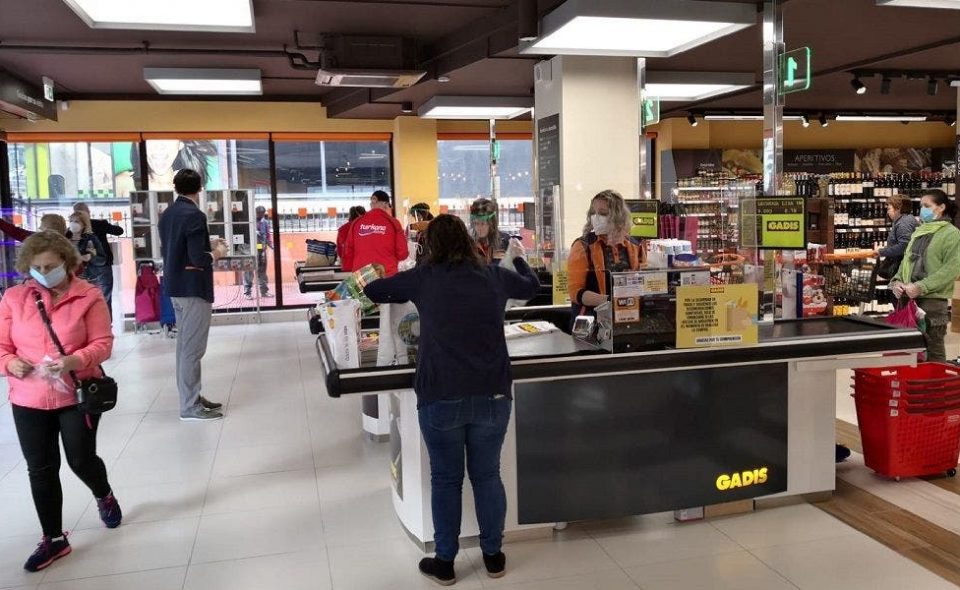
Locate an element on the screen. The height and width of the screenshot is (590, 960). checkout counter is located at coordinates (591, 362), (535, 310), (319, 278).